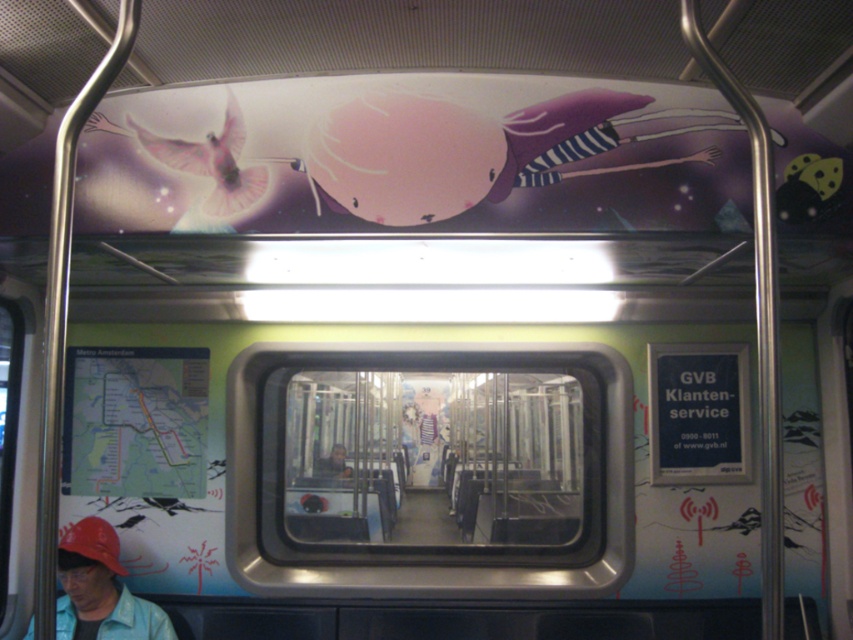
Question: Which of the following is the farthest from the observer?

Choices:
 (A) (62, 589)
 (B) (102, 541)

Answer: (A)

Question: Which object appears closest to the camera in this image?

Choices:
 (A) matte red hat at lower left
 (B) matte red baseball cap at lower left

Answer: (A)

Question: Does matte red hat at lower left appear over matte red baseball cap at lower left?

Choices:
 (A) no
 (B) yes

Answer: (A)

Question: Does matte red hat at lower left appear on the left side of matte red baseball cap at lower left?

Choices:
 (A) no
 (B) yes

Answer: (B)

Question: Can you confirm if matte red hat at lower left is bigger than matte red baseball cap at lower left?

Choices:
 (A) no
 (B) yes

Answer: (B)

Question: Which of the following is the closest to the observer?

Choices:
 (A) matte red baseball cap at lower left
 (B) matte red hat at lower left

Answer: (B)